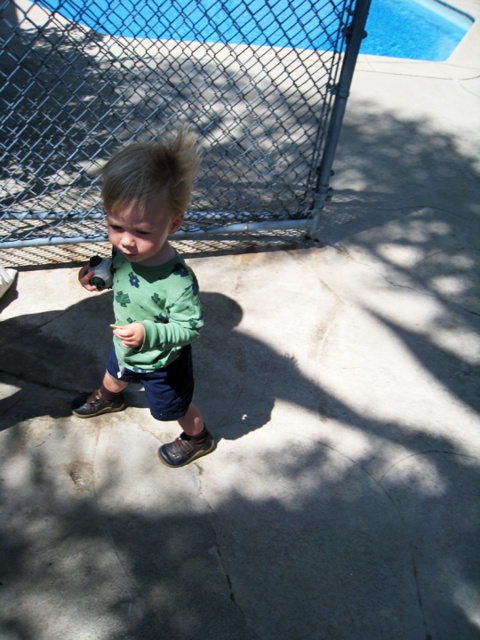
Does metallic chain-link fence at center appear under blue glass pool at upper center?

Indeed, metallic chain-link fence at center is positioned under blue glass pool at upper center.

At what (x,y) coordinates should I click in order to perform the action: click on metallic chain-link fence at center. Please return your answer as a coordinate pair (x, y). This screenshot has height=640, width=480. Looking at the image, I should click on (171, 108).

The image size is (480, 640). Identify the location of metallic chain-link fence at center. (171, 108).

Is point (181, 273) farther from viewer compared to point (311, 22)?

No.

Is point (104, 195) closer to camera compared to point (428, 19)?

Yes.

This screenshot has width=480, height=640. In order to click on green cotton shirt at center in this screenshot , I will do `click(152, 291)`.

Based on the photo, can you confirm if metallic chain-link fence at center is positioned below green cotton shirt at center?

No.

This screenshot has width=480, height=640. Describe the element at coordinates (171, 108) in the screenshot. I see `metallic chain-link fence at center` at that location.

The image size is (480, 640). In order to click on metallic chain-link fence at center in this screenshot , I will do pos(171,108).